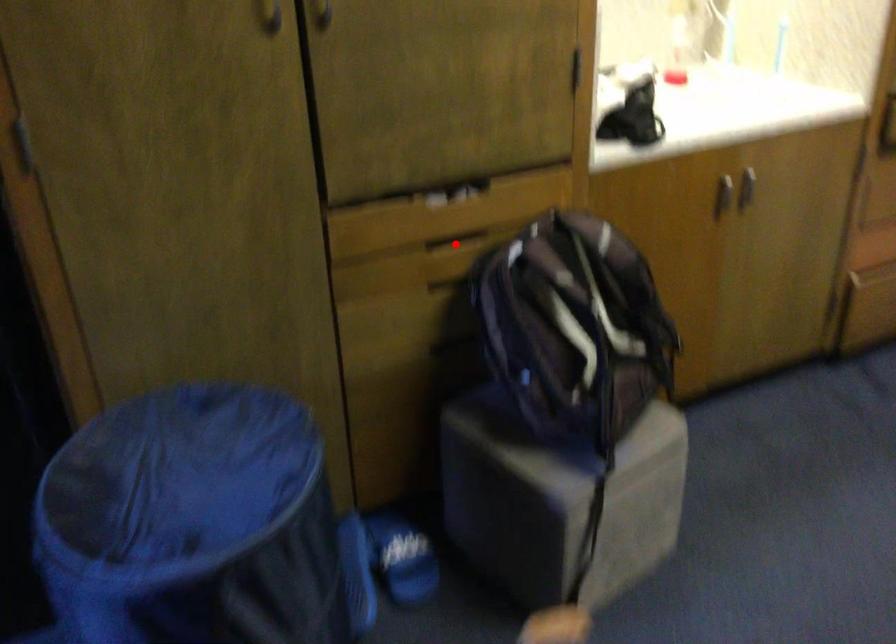
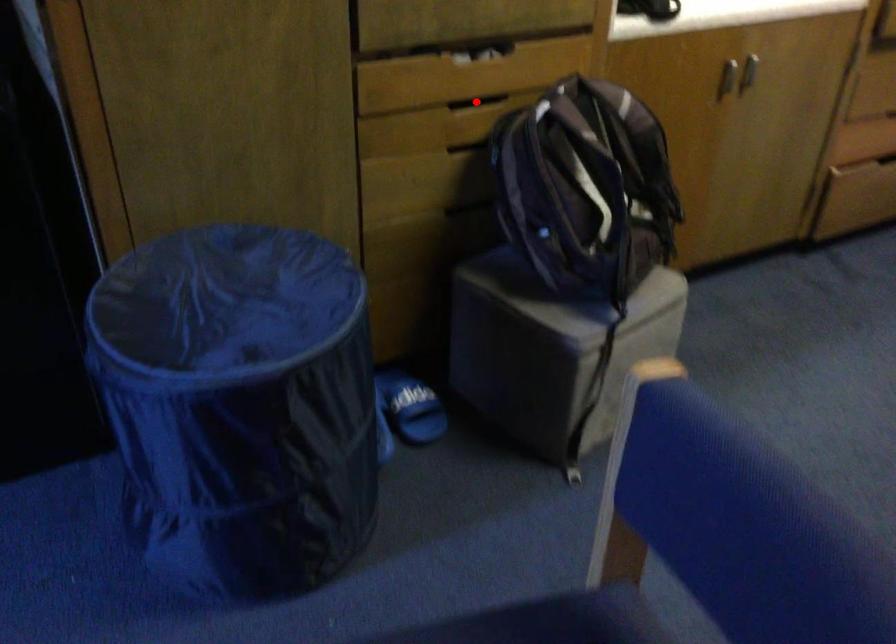
I am providing you with two images of the same scene from different viewpoints. A red point is marked on the first image and another point is marked on the second image. Are the points marked in image1 and image2 representing the same 3D position?

Yes